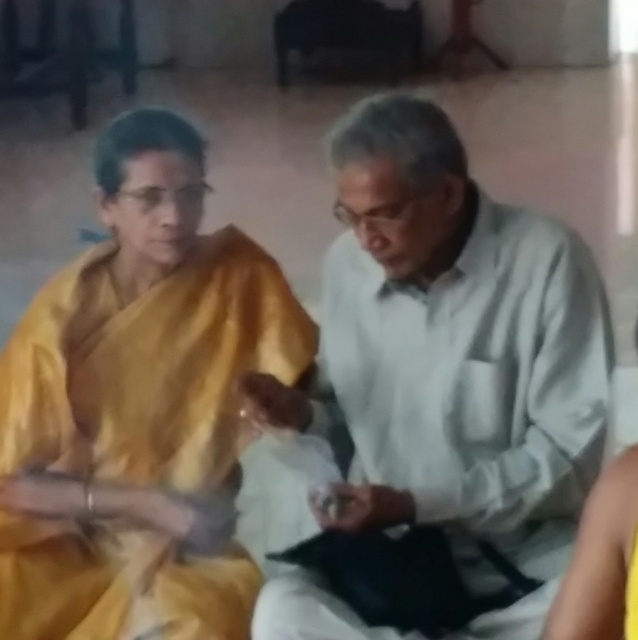
You are a photographer observing two people in a ceremony. You see the white matte shirt at center and the yellow silk saree at left. Which one is located to the right of the other?

The white matte shirt at center is positioned on the right side of yellow silk saree at left, so the white matte shirt at center is to the right of the yellow silk saree at left.

You are a photographer standing in front of the scene. You want to take a photo that includes both the white matte shirt at center and the yellow silk saree at left. Which one will appear larger in the photo?

The white matte shirt at center will appear larger in the photo because it is closer to the viewer than the yellow silk saree at left.